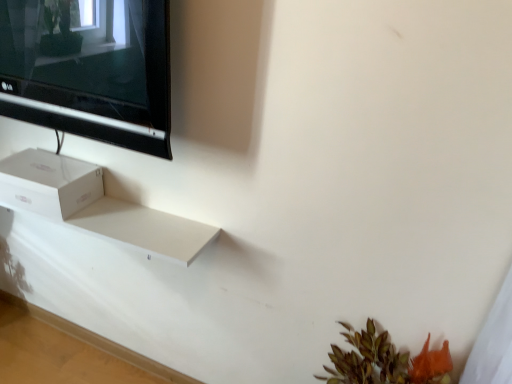
Question: Looking at the image, does black glossy tv at upper left seem bigger or smaller compared to white cardboard box at lower left?

Choices:
 (A) big
 (B) small

Answer: (A)

Question: Would you say black glossy tv at upper left is to the left or to the right of white cardboard box at lower left in the picture?

Choices:
 (A) right
 (B) left

Answer: (A)

Question: Considering the positions of black glossy tv at upper left and white cardboard box at lower left in the image, is black glossy tv at upper left wider or thinner than white cardboard box at lower left?

Choices:
 (A) thin
 (B) wide

Answer: (A)

Question: Do you think white cardboard box at lower left is within black glossy tv at upper left, or outside of it?

Choices:
 (A) outside
 (B) inside

Answer: (A)

Question: From a real-world perspective, is white cardboard box at lower left above or below black glossy tv at upper left?

Choices:
 (A) below
 (B) above

Answer: (A)

Question: From the image's perspective, is white cardboard box at lower left positioned above or below black glossy tv at upper left?

Choices:
 (A) above
 (B) below

Answer: (B)

Question: Looking at their shapes, would you say white cardboard box at lower left is wider or thinner than black glossy tv at upper left?

Choices:
 (A) wide
 (B) thin

Answer: (A)